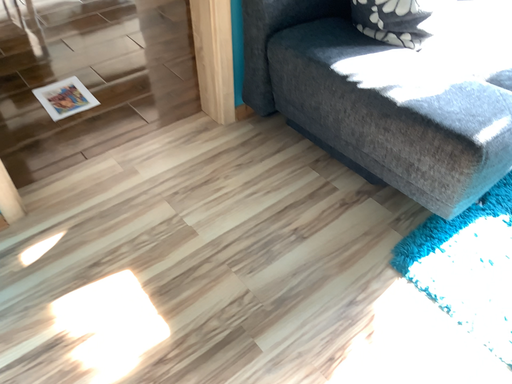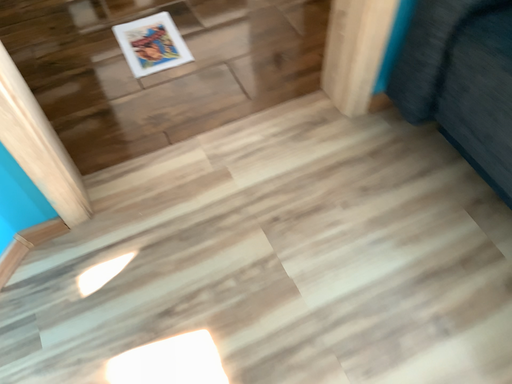
Question: How did the camera likely rotate when shooting the video?

Choices:
 (A) rotated right
 (B) rotated left

Answer: (B)